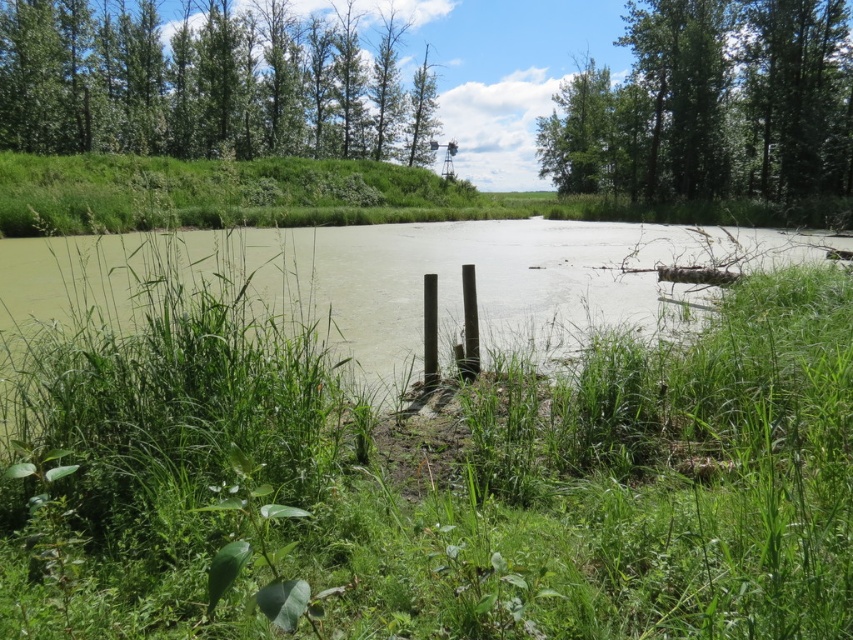
Between green grass at center and green leafy trees at upper center, which one appears on the left side from the viewer's perspective?

Positioned to the left is green leafy trees at upper center.

Is green grass at center positioned before green leafy trees at upper center?

Yes, green grass at center is closer to the viewer.

Find the location of a particular element. This screenshot has width=853, height=640. green grass at center is located at coordinates (426, 438).

At what (x,y) coordinates should I click in order to perform the action: click on green grass at center. Please return your answer as a coordinate pair (x, y). Looking at the image, I should click on (426, 438).

Is green grass at center thinner than green leafy tree at upper right?

In fact, green grass at center might be wider than green leafy tree at upper right.

Does point (257, 541) lie behind point (660, 29)?

No.

Which is in front, point (190, 406) or point (691, 45)?

Point (190, 406)

What are the coordinates of `green grass at center` in the screenshot? It's located at (426, 438).

Does green leafy trees at upper center appear on the left side of green leafy tree at upper right?

Yes, green leafy trees at upper center is to the left of green leafy tree at upper right.

Between green leafy trees at upper center and green leafy tree at upper right, which one is positioned lower?

green leafy trees at upper center is lower down.

Which is in front, point (234, 44) or point (631, 132)?

Point (631, 132) is more forward.

Identify the location of green leafy trees at upper center. The width and height of the screenshot is (853, 640). (202, 83).